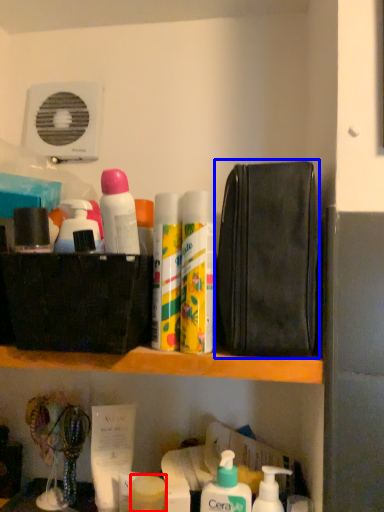
Question: Which of the following is the farthest to the observer, toiletry (highlighted by a red box) or pouch (highlighted by a blue box)?

Choices:
 (A) toiletry
 (B) pouch

Answer: (A)